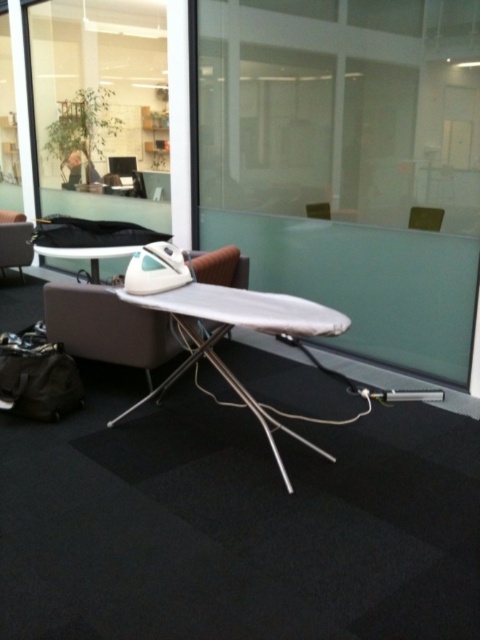
You are organizing a small event and need to place a tablecloth that requires 2 meters of space. You have the white plastic ironing board at center and the matte brown leather chair at left. Which object can accommodate the tablecloth based on their sizes?

The white plastic ironing board at center is larger in size than the matte brown leather chair at left, so the white plastic ironing board at center can accommodate the tablecloth as it has more space.

You are a delivery person who needs to place a new 1.2 meter wide desk in this office. The desk must be placed where the white glossy ironing board at center and the white plastic ironing board at center are currently located. Can both ironing boards fit alongside the desk if the desk is placed there?

The white glossy ironing board at center has a larger width than the white plastic ironing board at center. However, since the desk is 1.2 meters wide and both ironing boards would need space, it is uncertain if they can fit without overlapping. More information about their exact widths is needed to determine feasibility.

You are setting up a workspace in this room and need to place a new desk between the white plastic ironing board at center and the matte brown leather chair at left. Which object should the desk be closer to if you want the desk to be at the same height as the shorter object?

The desk should be closer to the white plastic ironing board at center because it has a lesser height compared to the matte brown leather chair at left, so placing the desk near the shorter object ensures the desk matches its height.